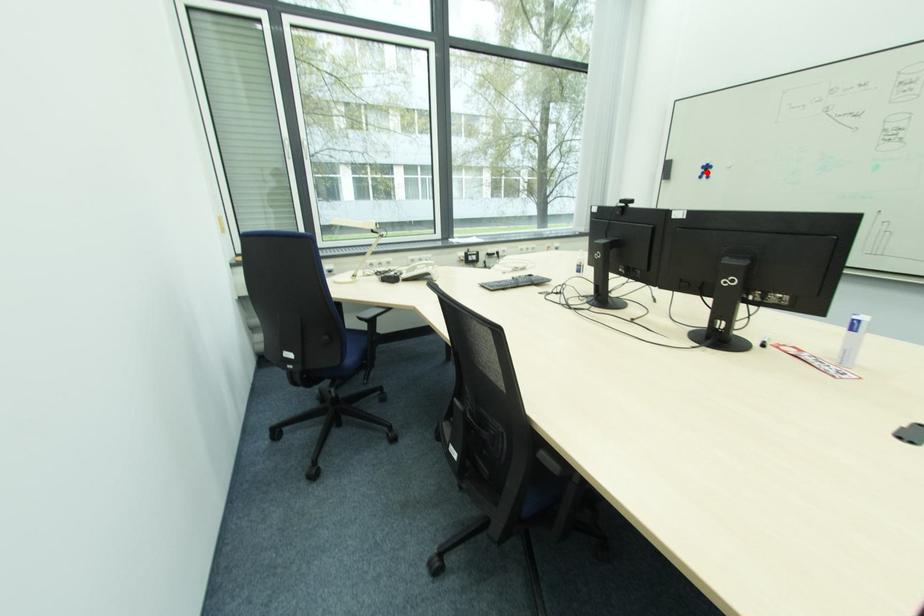
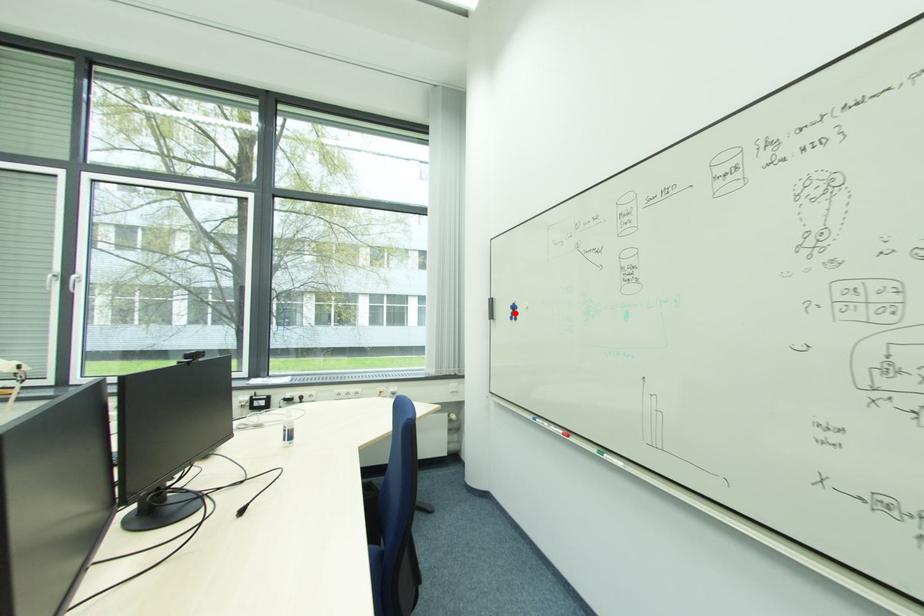
I am providing you with two images of the same scene from different viewpoints. A red point is marked on the first image and another point is marked on the second image. Do the highlighted points in image1 and image2 indicate the same real-world spot?

Yes